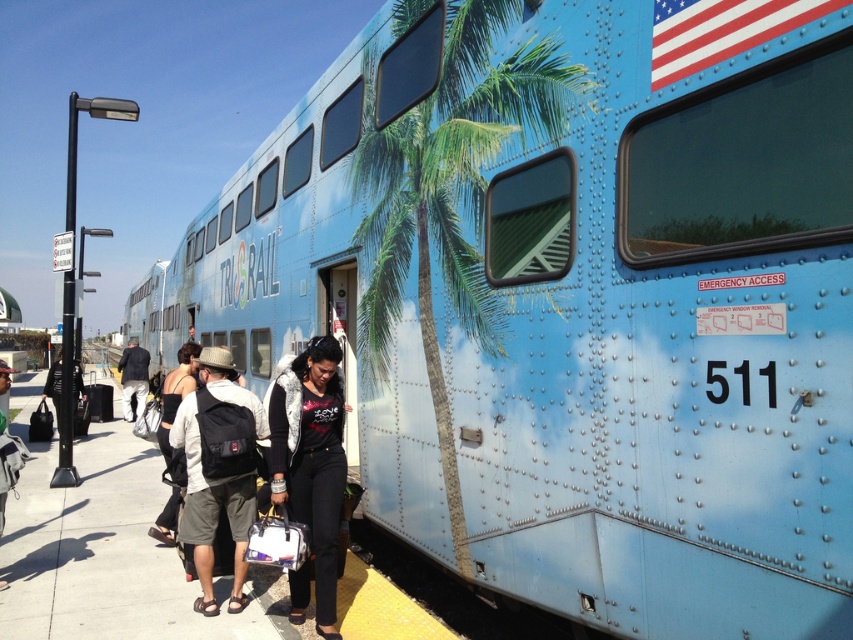
You are a passenger at the train station. You see a person wearing a white cotton shirt at center and another wearing a denim jacket at lower left. Which clothing item is higher in position?

The white cotton shirt at center is above the denim jacket at lower left, so the white cotton shirt at center is higher in position.